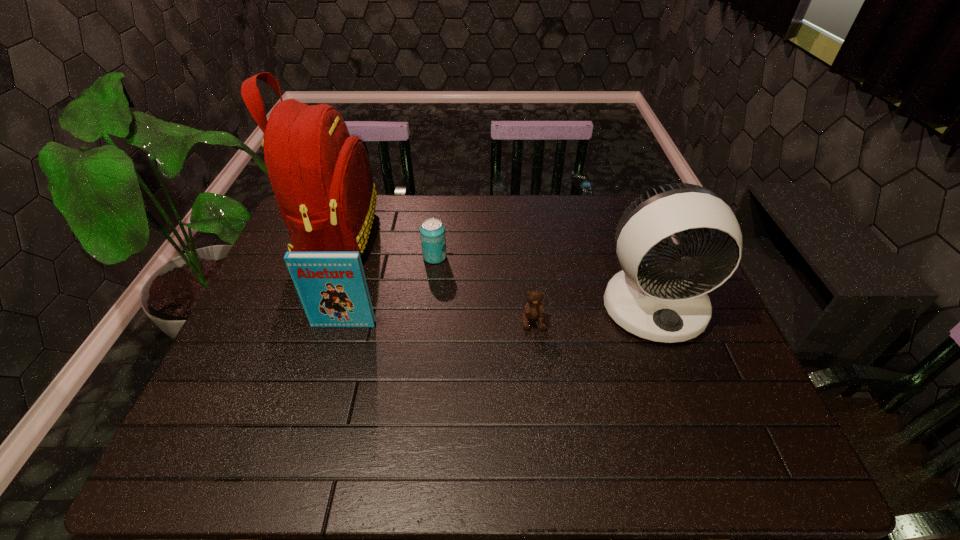
Find the location of `free spot between the tallest object and the shortest object`. free spot between the tallest object and the shortest object is located at coordinates (435, 279).

Identify the location of the closest object to the backpack. (432, 231).

You are a GUI agent. You are given a task and a screenshot of the screen. Output one action in this format:
    pyautogui.click(x=<x>, y=<y>)
    Task: Click on the object that is the second closest to the third tallest object
    This screenshot has height=540, width=960.
    Given the screenshot: What is the action you would take?
    pyautogui.click(x=432, y=231)

Find the location of a particular element. vacant space that satisfies the following two spatial constraints: 1. on the front-facing side of the backpack; 2. on the left side of the third object from right to left is located at coordinates (329, 257).